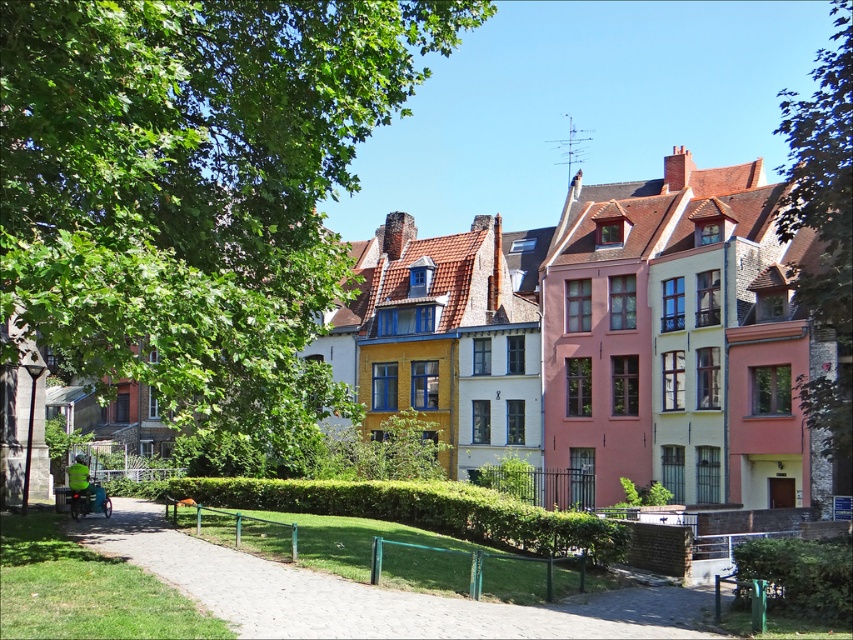
You are standing in the middle of the street looking at the colorful buildings. There are two points marked on the buildings. One is at point coordinates point (695, 592) and the other is at point coordinates point (834, 189). Which point is closer to you?

Point (834, 189) is closer to you than point (695, 592) because the description states that point (695, 592) is further to the camera than point (834, 189).

You are standing at the center of the scene and want to walk to the smooth concrete path at lower left. Which direction should you move to reach it?

To reach the smooth concrete path at lower left, you should move towards the lower left direction since it is located at point (370, 595).